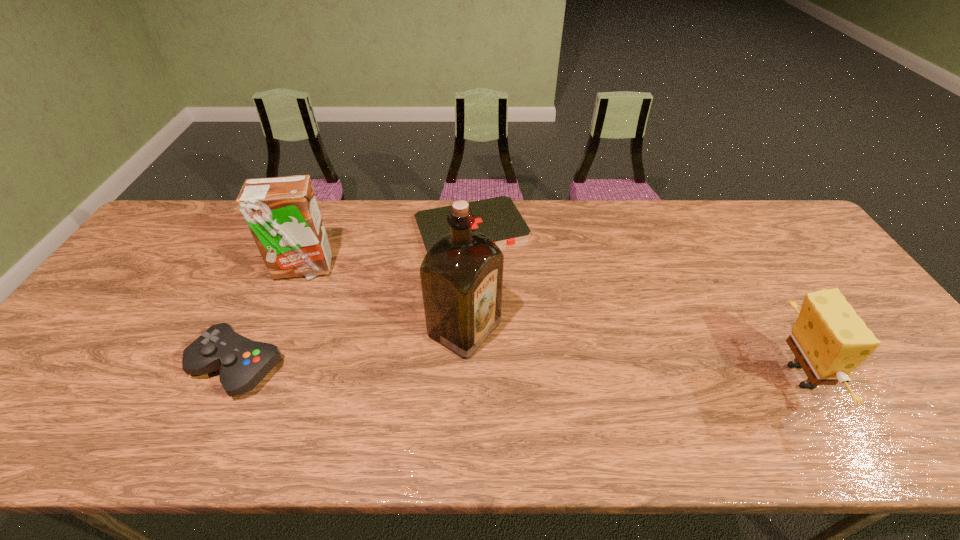
Identify the location of the second shortest object. (243, 363).

Locate an element on the screen. Image resolution: width=960 pixels, height=540 pixels. sponge is located at coordinates (829, 340).

Locate an element on the screen. Image resolution: width=960 pixels, height=540 pixels. the third tallest object is located at coordinates (829, 340).

I want to click on carton, so click(x=282, y=213).

Find the location of `the tallest object`. the tallest object is located at coordinates click(x=461, y=275).

You are a GUI agent. You are given a task and a screenshot of the screen. Output one action in this format:
    pyautogui.click(x=<x>, y=<y>)
    Task: Click on the first-aid kit
    The image size is (960, 540).
    Given the screenshot: What is the action you would take?
    pyautogui.click(x=498, y=218)

I want to click on vacant space situated on the left of the control, so click(109, 367).

Identify the location of vacant position located on the face of the rightmost object. (885, 376).

The image size is (960, 540). Find the location of `vacant space situated 0.390m on the straw side of the carton`. vacant space situated 0.390m on the straw side of the carton is located at coordinates (416, 350).

The width and height of the screenshot is (960, 540). Find the location of `free region located on the straw side of the carton`. free region located on the straw side of the carton is located at coordinates (350, 299).